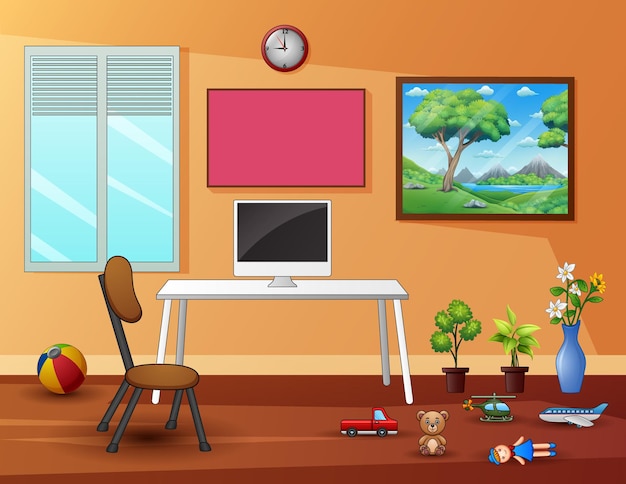
Where is `painting`? The width and height of the screenshot is (626, 484). painting is located at coordinates pos(444,197).